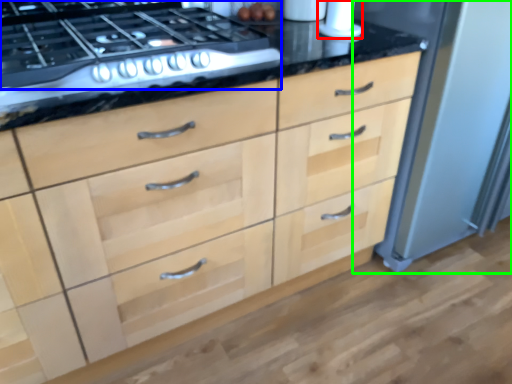
Question: Considering the real-world distances, which object is farthest from appliance (highlighted by a red box)? gas stove (highlighted by a blue box) or appliance (highlighted by a green box)?

Choices:
 (A) gas stove
 (B) appliance

Answer: (A)